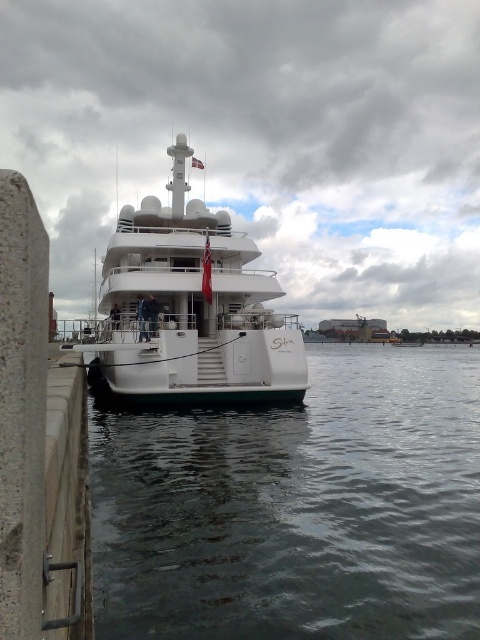
Question: Which point appears closest to the camera in this image?

Choices:
 (A) (331, 428)
 (B) (152, 248)

Answer: (A)

Question: Is clear water at lower center to the left of white glossy yacht at center from the viewer's perspective?

Choices:
 (A) yes
 (B) no

Answer: (B)

Question: Is clear water at lower center closer to camera compared to white glossy yacht at center?

Choices:
 (A) yes
 (B) no

Answer: (A)

Question: Does clear water at lower center have a larger size compared to white glossy yacht at center?

Choices:
 (A) no
 (B) yes

Answer: (A)